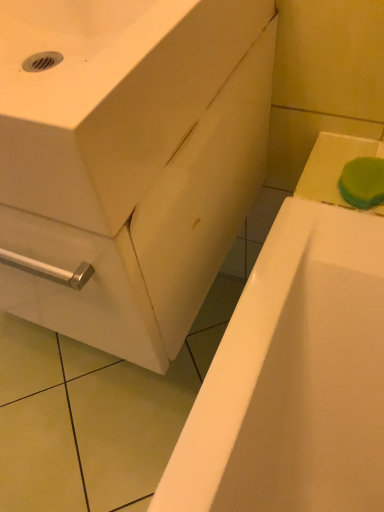
Question: Does white glossy bathtub at lower right have a greater width compared to green sponge at upper right?

Choices:
 (A) no
 (B) yes

Answer: (B)

Question: Would you say white glossy bathtub at lower right contains green sponge at upper right?

Choices:
 (A) no
 (B) yes

Answer: (A)

Question: Is white glossy bathtub at lower right aimed at green sponge at upper right?

Choices:
 (A) yes
 (B) no

Answer: (B)

Question: Is white glossy bathtub at lower right positioned with its back to green sponge at upper right?

Choices:
 (A) yes
 (B) no

Answer: (B)

Question: Can you confirm if white glossy bathtub at lower right is thinner than green sponge at upper right?

Choices:
 (A) yes
 (B) no

Answer: (B)

Question: Does white glossy bathtub at lower right have a larger size compared to green sponge at upper right?

Choices:
 (A) no
 (B) yes

Answer: (B)

Question: Is white glossy sink at center shorter than white glossy bathtub at lower right?

Choices:
 (A) no
 (B) yes

Answer: (A)

Question: Would you say white glossy sink at center contains white glossy bathtub at lower right?

Choices:
 (A) no
 (B) yes

Answer: (A)

Question: From a real-world perspective, is white glossy sink at center beneath white glossy bathtub at lower right?

Choices:
 (A) no
 (B) yes

Answer: (A)

Question: Is white glossy sink at center with white glossy bathtub at lower right?

Choices:
 (A) yes
 (B) no

Answer: (B)

Question: Does white glossy sink at center have a larger size compared to white glossy bathtub at lower right?

Choices:
 (A) yes
 (B) no

Answer: (B)

Question: Can you confirm if white glossy sink at center is smaller than white glossy bathtub at lower right?

Choices:
 (A) yes
 (B) no

Answer: (A)

Question: Can you confirm if white glossy sink at center is thinner than green sponge at upper right?

Choices:
 (A) no
 (B) yes

Answer: (A)